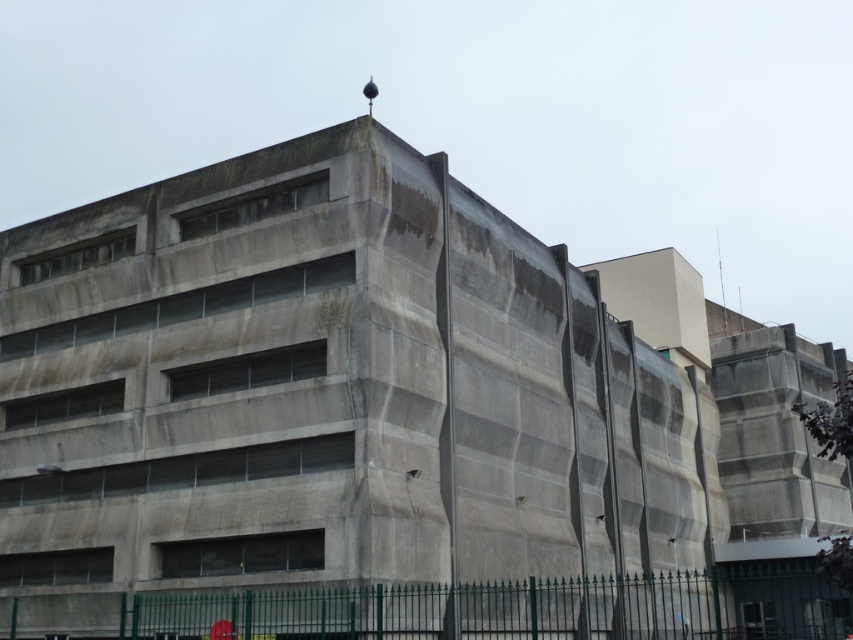
You are a maintenance worker needing to inspect a camera located on the top level of the gray concrete building at center. The safety regulations state that you can only work on objects within 80 feet of the ground. Can you safely perform this inspection from the ground without needing additional equipment?

The gray concrete building at center and camera are 85.79 feet apart, which exceeds the 80 feet safety regulation limit. Therefore, you cannot safely perform the inspection from the ground without additional equipment.

You are standing at the origin point of the coordinate system. Where is the gray concrete building at center located in terms of coordinates?

The gray concrete building at center is located at coordinates point (329, 388).

You are a delivery driver with a truck that is 3 meters long. You need to back your truck into a space between the gray concrete building at center and the green wrought iron fence at lower center. Is there enough space for your truck to fit between them?

The distance between the gray concrete building at center and the green wrought iron fence at lower center is 6.47 meters. Since your truck is 3 meters long, there is sufficient space for it to fit between them.